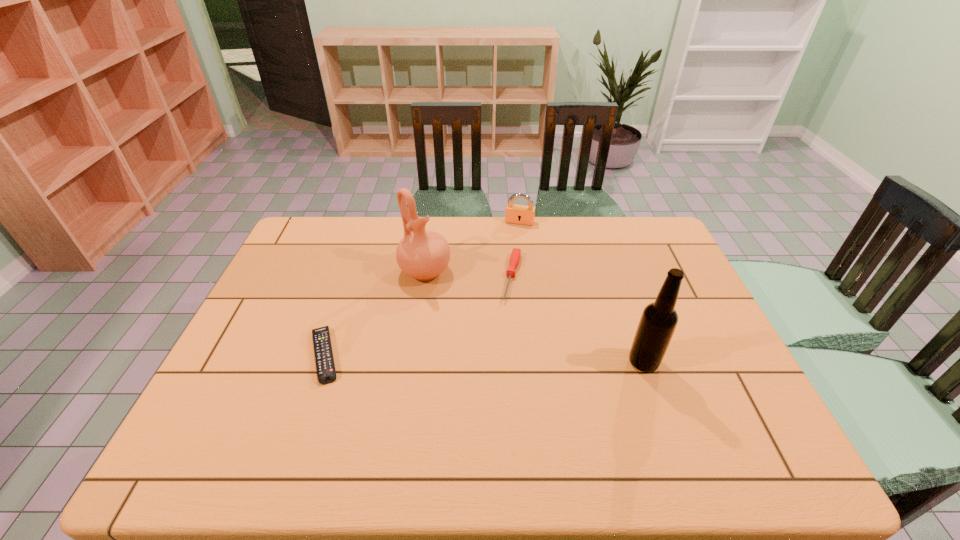
The image size is (960, 540). I want to click on screwdriver that is at the far edge, so click(x=516, y=253).

I want to click on vacant space at the far edge of the desktop, so click(x=504, y=242).

Identify the location of vacant area at the near edge of the desktop. The image size is (960, 540). (494, 407).

Find the location of a particular element. free region at the left edge of the desktop is located at coordinates (315, 294).

At what (x,y) coordinates should I click in order to perform the action: click on vacant space at the near left corner of the desktop. Please return your answer as a coordinate pair (x, y). Looking at the image, I should click on (238, 428).

Where is `vacant position at the far right corner of the desktop`? Image resolution: width=960 pixels, height=540 pixels. vacant position at the far right corner of the desktop is located at coordinates (632, 228).

The width and height of the screenshot is (960, 540). What are the coordinates of `free space that is in between the pottery and the third tallest object` in the screenshot? It's located at (472, 247).

The height and width of the screenshot is (540, 960). In order to click on vacant point located between the fourth object from right to left and the second shortest object in this screenshot , I will do `click(468, 274)`.

You are a GUI agent. You are given a task and a screenshot of the screen. Output one action in this format:
    pyautogui.click(x=<x>, y=<y>)
    Task: Click on the free space between the shortest object and the rightmost object
    This screenshot has width=960, height=540.
    Given the screenshot: What is the action you would take?
    pyautogui.click(x=484, y=358)

Find the location of a particular element. The width and height of the screenshot is (960, 540). free space between the screwdriver and the beer bottle is located at coordinates (578, 320).